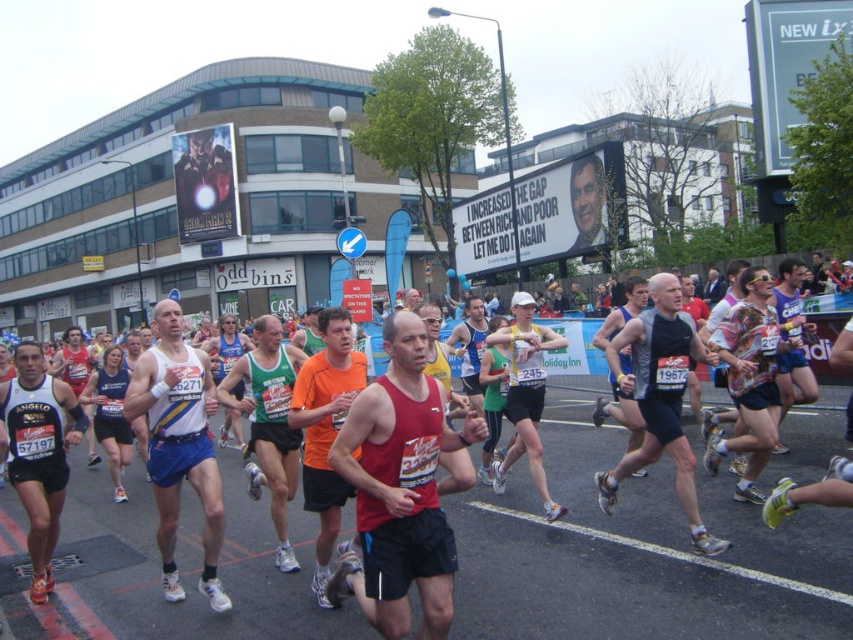
Does orange fabric shirt at center appear under green jersey at center?

Actually, orange fabric shirt at center is above green jersey at center.

Is orange fabric shirt at center shorter than green jersey at center?

Correct, orange fabric shirt at center is not as tall as green jersey at center.

Locate an element on the screen. orange fabric shirt at center is located at coordinates (325, 432).

In order to click on orange fabric shirt at center in this screenshot , I will do `click(325, 432)`.

Between matte black jacket at center and smooth skin face at center, which one is positioned higher?

Positioned higher is matte black jacket at center.

Does matte black jacket at center lie behind smooth skin face at center?

Yes.

Does point (192, 154) come farther from viewer compared to point (582, 176)?

Yes, point (192, 154) is farther from viewer.

The width and height of the screenshot is (853, 640). Find the location of `matte black jacket at center`. matte black jacket at center is located at coordinates (206, 176).

Who is higher up, white mesh tank top at center or orange fabric shirt at center?

orange fabric shirt at center is above.

From the picture: Who is positioned more to the left, white mesh tank top at center or orange fabric shirt at center?

white mesh tank top at center is more to the left.

Who is more distant from viewer, (x=161, y=451) or (x=334, y=532)?

The point (x=161, y=451) is behind.

I want to click on white mesh tank top at center, so click(x=178, y=445).